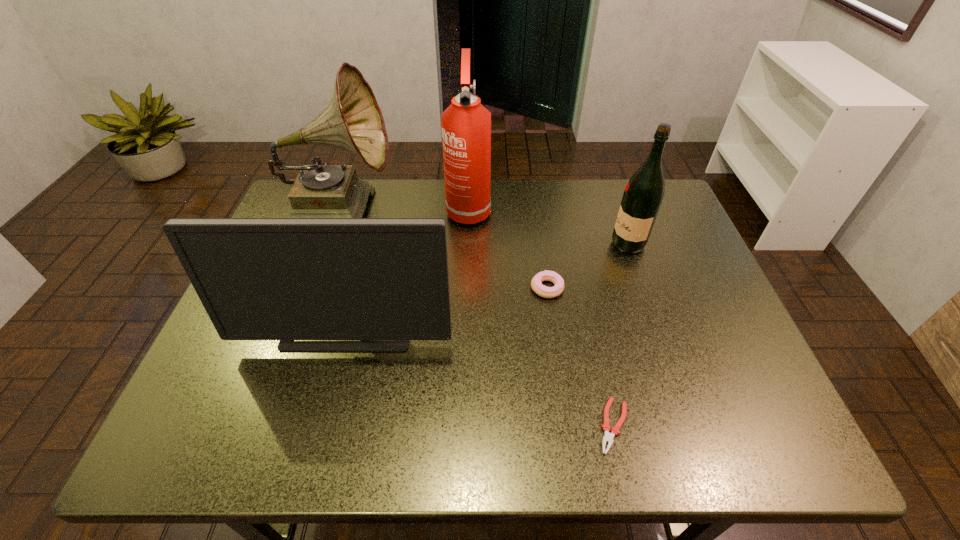
Locate an element on the screen. This screenshot has height=540, width=960. vacant space located 0.080m on the front-facing side of the rightmost object is located at coordinates (583, 244).

This screenshot has height=540, width=960. What are the coordinates of `vacant space positioned 0.350m on the front-facing side of the rightmost object` in the screenshot? It's located at (486, 244).

Locate an element on the screen. vacant space positioned on the front-facing side of the rightmost object is located at coordinates (504, 244).

Where is `vacant space situated 0.160m on the screen side of the computer monitor`? vacant space situated 0.160m on the screen side of the computer monitor is located at coordinates (324, 423).

At what (x,y) coordinates should I click in order to perform the action: click on vacant space located 0.390m on the left of the third object from right to left. Please return your answer as a coordinate pair (x, y). The width and height of the screenshot is (960, 540). Looking at the image, I should click on (376, 288).

I want to click on vacant space situated on the left of the shortest object, so click(x=510, y=426).

I want to click on fire extinguisher that is at the far edge, so point(466,124).

The width and height of the screenshot is (960, 540). Find the location of `record player located at the far edge`. record player located at the far edge is located at coordinates (352, 120).

Where is `object present at the near edge`? object present at the near edge is located at coordinates (608, 437).

The height and width of the screenshot is (540, 960). Find the location of `record player at the left edge`. record player at the left edge is located at coordinates (352, 120).